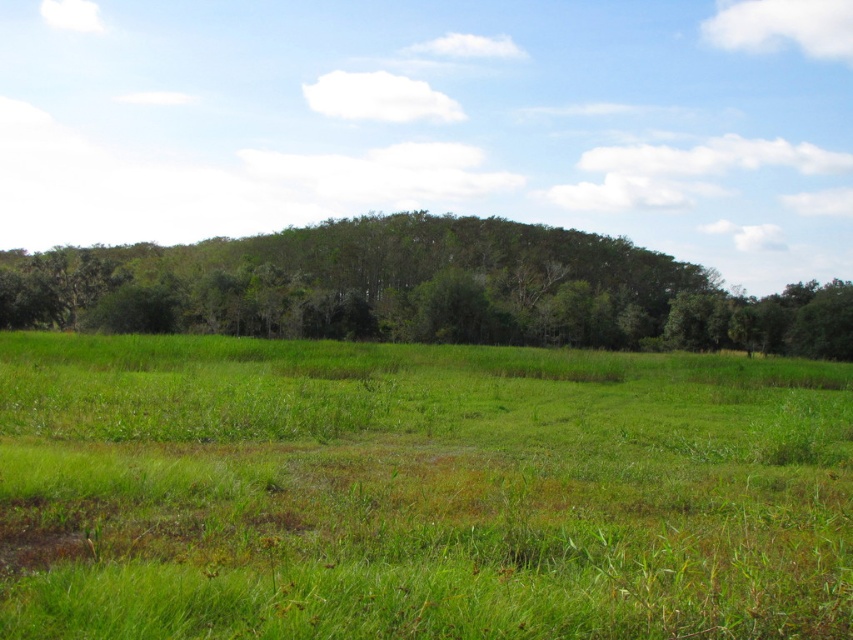
Question: Is green grassy pasture at center below green leafy trees at center?

Choices:
 (A) no
 (B) yes

Answer: (B)

Question: Is green grassy pasture at center wider than green leafy trees at center?

Choices:
 (A) no
 (B) yes

Answer: (A)

Question: Which point is farther to the camera?

Choices:
 (A) green leafy trees at center
 (B) green grassy pasture at center

Answer: (A)

Question: Is green grassy pasture at center closer to camera compared to green leafy trees at center?

Choices:
 (A) yes
 (B) no

Answer: (A)

Question: Which of the following is the farthest from the observer?

Choices:
 (A) green leafy trees at center
 (B) green grassy pasture at center

Answer: (A)

Question: Which point is farther to the camera?

Choices:
 (A) green leafy trees at center
 (B) green grassy pasture at center

Answer: (A)